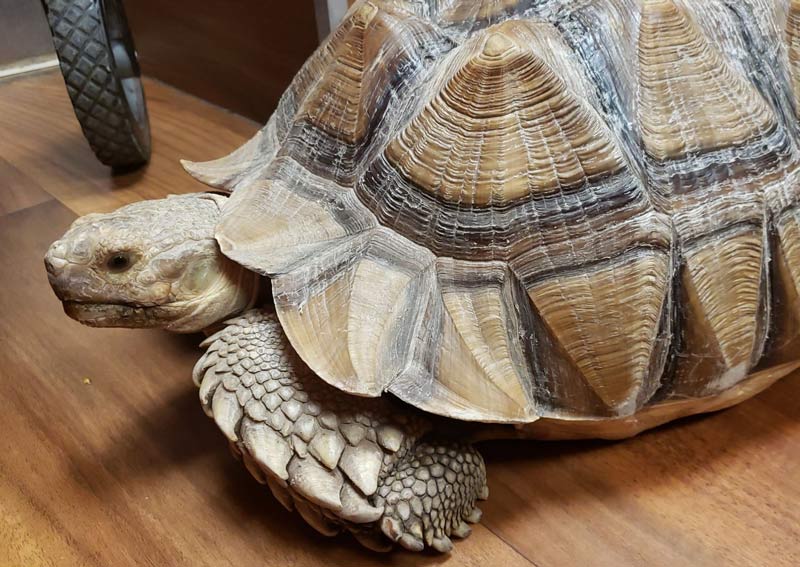
Image resolution: width=800 pixels, height=567 pixels. I want to click on floor, so click(66, 460).